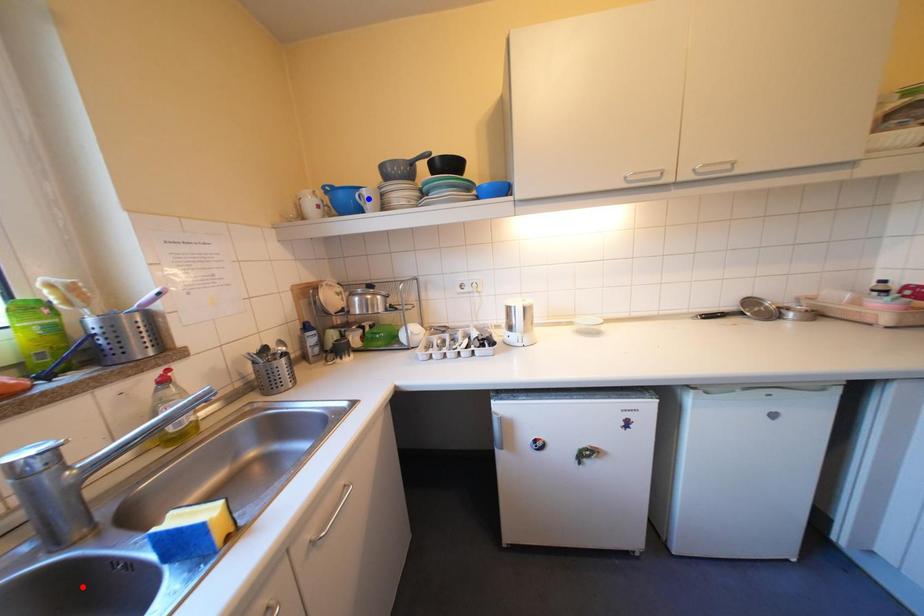
Question: In the image, two points are highlighted. Which point is nearer to the camera? Reply with the corresponding letter.

Choices:
 (A) blue point
 (B) red point

Answer: (B)